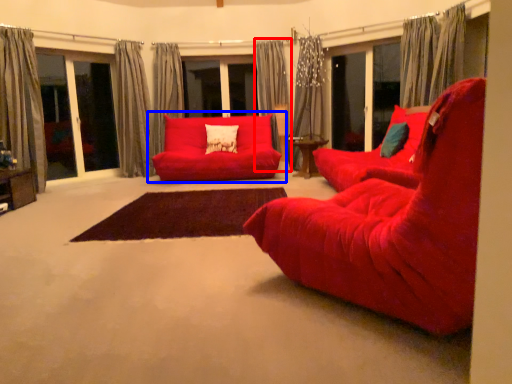
Question: Which object appears farthest to the camera in this image, curtain (highlighted by a red box) or studio couch (highlighted by a blue box)?

Choices:
 (A) curtain
 (B) studio couch

Answer: (A)